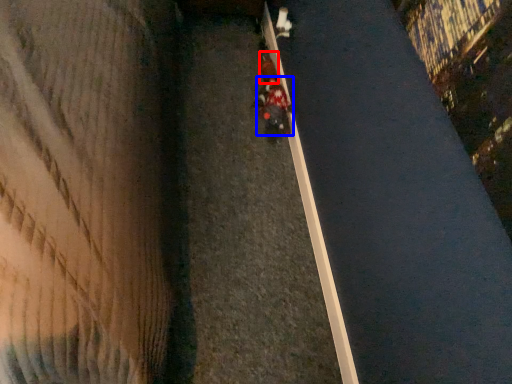
Question: Which object appears closest to the camera in this image, pedestrian (highlighted by a red box) or person (highlighted by a blue box)?

Choices:
 (A) pedestrian
 (B) person

Answer: (B)